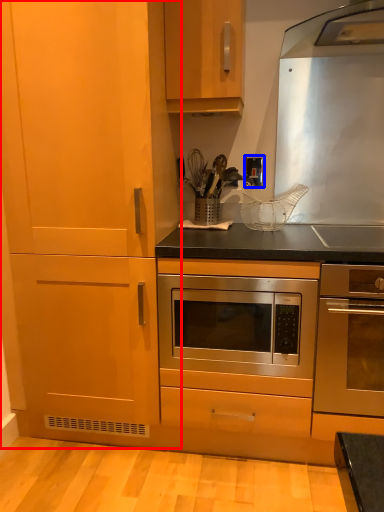
Question: Which object appears closest to the camera in this image, cabinetry (highlighted by a red box) or electric outlet (highlighted by a blue box)?

Choices:
 (A) cabinetry
 (B) electric outlet

Answer: (A)